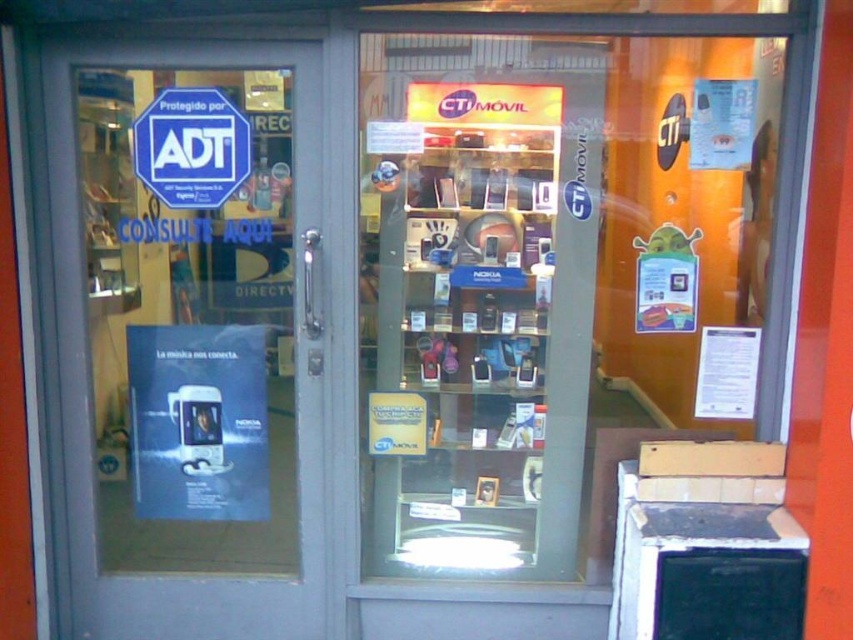
You are a delivery person trying to hand over a package to the CTI M?vil shop. The package is too large to fit through the door. Can you slide it under the gray glass door at left instead? Explain why or why not based on the size comparison between the door and the blue plastic sign at upper left.

The gray glass door at left is larger than the blue plastic sign at upper left. Since the door is bigger, there might be enough space under it to slide the package. However, the description only mentions their sizes relative to each other, not the actual dimensions or clearance height. Without knowing the exact size of the package or the door gap, it is uncertain if it will fit.

Based on the photo, you are a customer entering the mobile phone shop and want to check the security sign first. Which object should you look at first, the gray glass door at left or the blue plastic sign at upper left?

The blue plastic sign at upper left is on the right side of the gray glass door at left, so you should look at the blue plastic sign at upper left first as it is positioned to the right of the door.

You are a customer entering the mobile phone shop and want to see the blue plastic sign at upper left. Which direction should you look relative to the gray glass door at left?

The blue plastic sign at upper left is above the gray glass door at left, so you should look upward from the gray glass door at left to see the blue plastic sign at upper left.